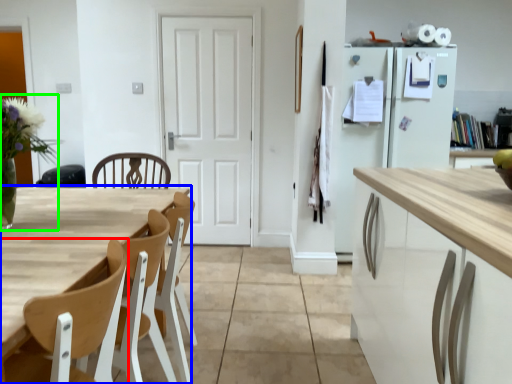
Question: Which object is positioned closest to chair (highlighted by a red box)? Select from table (highlighted by a blue box) and floral arrangement (highlighted by a green box).

Choices:
 (A) table
 (B) floral arrangement

Answer: (A)